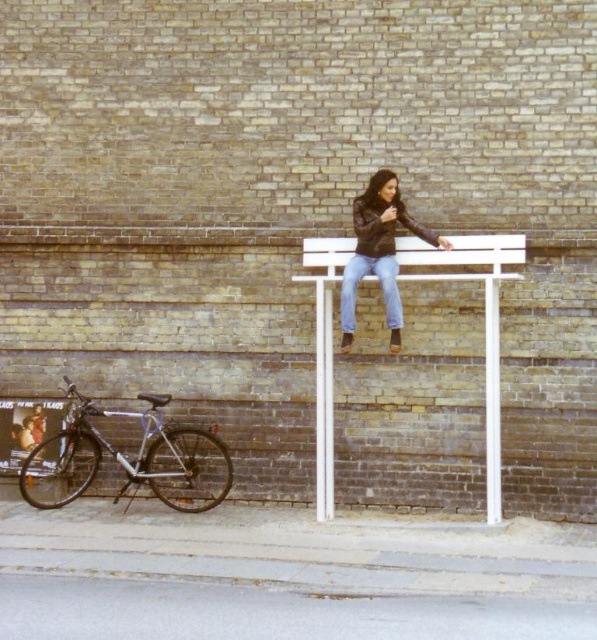
Looking at this image, can you confirm if silver metallic bicycle at lower left is positioned above blue denim jeans at center?

No.

Is silver metallic bicycle at lower left closer to the viewer compared to blue denim jeans at center?

No, silver metallic bicycle at lower left is further to the viewer.

Between point (183, 481) and point (346, 324), which one is positioned in front?

Positioned in front is point (346, 324).

This screenshot has height=640, width=597. What are the coordinates of `silver metallic bicycle at lower left` in the screenshot? It's located at (127, 460).

Which is behind, point (387, 260) or point (395, 294)?

The point (387, 260) is more distant.

Does leather jacket at center appear over blue denim jeans at center?

Indeed, leather jacket at center is positioned over blue denim jeans at center.

Between point (396, 214) and point (387, 291), which one is positioned behind?

Point (396, 214)

The height and width of the screenshot is (640, 597). Identify the location of leather jacket at center. (378, 252).

Is silver metallic bicycle at lower left to the left of leather jacket at center from the viewer's perspective?

Yes, silver metallic bicycle at lower left is to the left of leather jacket at center.

Can you confirm if silver metallic bicycle at lower left is bigger than leather jacket at center?

Indeed, silver metallic bicycle at lower left has a larger size compared to leather jacket at center.

Who is more distant from viewer, (216,476) or (389,266)?

Positioned behind is point (216,476).

The width and height of the screenshot is (597, 640). Identify the location of silver metallic bicycle at lower left. (127, 460).